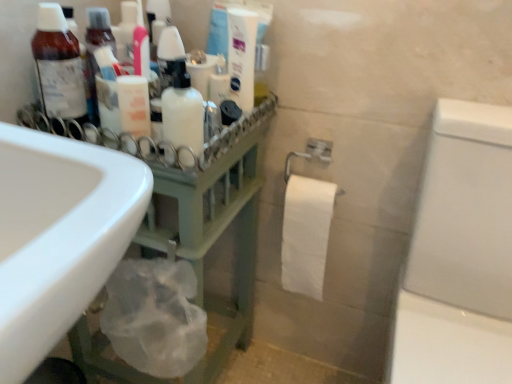
Question: Relative to white glossy toothpaste tube at upper center, is matte brown bottle at left in front or behind?

Choices:
 (A) behind
 (B) front

Answer: (B)

Question: Considering the positions of matte brown bottle at left and white glossy toothpaste tube at upper center in the image, is matte brown bottle at left wider or thinner than white glossy toothpaste tube at upper center?

Choices:
 (A) thin
 (B) wide

Answer: (B)

Question: Considering the real-world distances, which object is closest to the white matte lotion at center?

Choices:
 (A) white glossy toilet at right
 (B) white glossy toothpaste tube at upper center
 (C) matte brown bottle at left
 (D) green matte rack at left
 (E) white matte bottle at center

Answer: (E)

Question: Which object is the farthest from the matte brown bottle at left?

Choices:
 (A) white matte bottle at center
 (B) white glossy toilet at right
 (C) green matte rack at left
 (D) white matte lotion at center
 (E) white glossy toothpaste tube at upper center

Answer: (B)